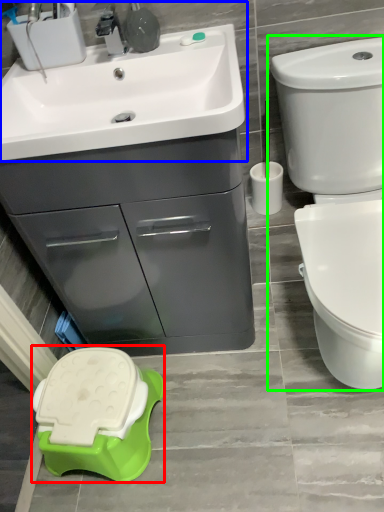
Question: Estimate the real-world distances between objects in this image. Which object is closer to porcelain (highlighted by a red box), sink (highlighted by a blue box) or toilet (highlighted by a green box)?

Choices:
 (A) sink
 (B) toilet

Answer: (B)